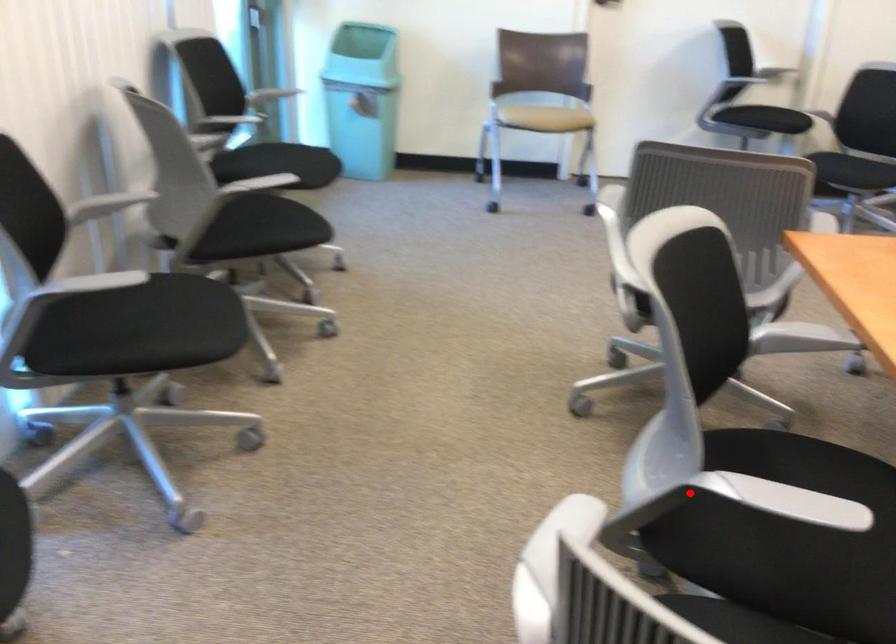
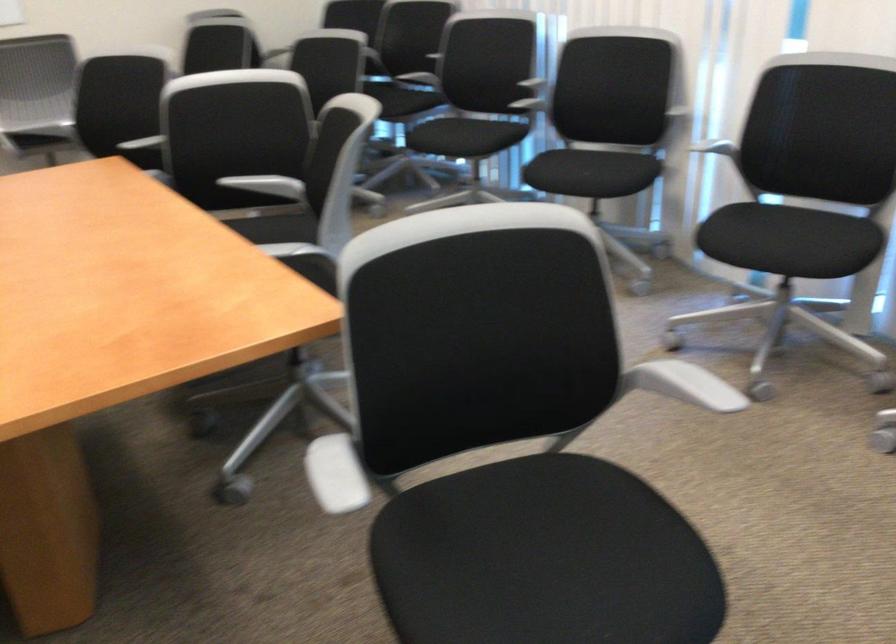
Find the pixel in the second image that matches the highlighted location in the first image.

(268, 185)